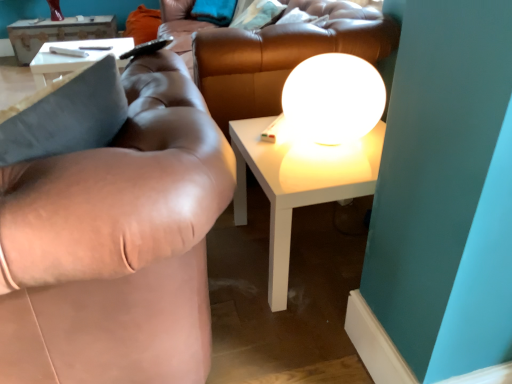
The height and width of the screenshot is (384, 512). I want to click on white glossy table at upper left, which ranks as the first table in left-to-right order, so click(56, 33).

Describe the element at coordinates (117, 244) in the screenshot. This screenshot has width=512, height=384. I see `brown leather couch at left` at that location.

This screenshot has width=512, height=384. Describe the element at coordinates (258, 15) in the screenshot. I see `soft teal pillow at upper center, arranged as the second pillow when viewed from the left` at that location.

This screenshot has width=512, height=384. What are the coordinates of `orange fabric pillow at upper left, the first pillow when ordered from back to front` in the screenshot? It's located at (142, 24).

The width and height of the screenshot is (512, 384). Describe the element at coordinates (272, 53) in the screenshot. I see `brown leather couch at center` at that location.

The image size is (512, 384). What do you see at coordinates (334, 98) in the screenshot? I see `white glossy sphere at upper center` at bounding box center [334, 98].

The width and height of the screenshot is (512, 384). I want to click on white glossy table at center, the second table when ordered from left to right, so click(298, 183).

Does white glossy table at center, the second table when ordered from left to right, come in front of brown leather couch at left?

No, it is not.

Is white glossy table at center, the first table in the right-to-left sequence, thinner than brown leather couch at left?

Yes.

In the image, is white glossy table at center, the second table when ordered from left to right, on the left side or the right side of brown leather couch at left?

In the image, white glossy table at center, the second table when ordered from left to right, appears on the right side of brown leather couch at left.

Where is `studio couch to the left of white glossy table at center, which appears as the first table when ordered from the bottom`? The image size is (512, 384). studio couch to the left of white glossy table at center, which appears as the first table when ordered from the bottom is located at coordinates (117, 244).

Which object is positioned more to the left, white glossy table at center, the 2th table from the top, or orange fabric pillow at upper left, the first pillow when ordered from back to front?

Positioned to the left is orange fabric pillow at upper left, the first pillow when ordered from back to front.

Is white glossy table at center, which appears as the first table when ordered from the bottom, oriented towards orange fabric pillow at upper left, which appears as the 1th pillow when viewed from the left?

No, white glossy table at center, which appears as the first table when ordered from the bottom, is not facing towards orange fabric pillow at upper left, which appears as the 1th pillow when viewed from the left.

Considering the sizes of white glossy table at center, the first table from the front, and orange fabric pillow at upper left, the 2th pillow from the front, in the image, is white glossy table at center, the first table from the front, wider or thinner than orange fabric pillow at upper left, the 2th pillow from the front,?

white glossy table at center, the first table from the front, is thinner than orange fabric pillow at upper left, the 2th pillow from the front.

Considering the points (244, 143) and (149, 20), which point is behind, point (244, 143) or point (149, 20)?

The point (149, 20) is more distant.

This screenshot has height=384, width=512. I want to click on pillow above the brown leather couch at left (from a real-world perspective), so click(x=258, y=15).

Is brown leather couch at left positioned in front of soft teal pillow at upper center, arranged as the 1th pillow when viewed from the front?

Yes, brown leather couch at left is closer to the camera.

Is brown leather couch at left to the left or to the right of soft teal pillow at upper center, arranged as the second pillow when viewed from the left, in the image?

brown leather couch at left is to the left of soft teal pillow at upper center, arranged as the second pillow when viewed from the left.

Based on the photo, who is taller, brown leather couch at left or soft teal pillow at upper center, arranged as the second pillow when viewed from the left?

brown leather couch at left.

Does point (369, 98) come farther from viewer compared to point (33, 44)?

No, (369, 98) is closer to viewer.

Considering the positions of objects white glossy sphere at upper center and white glossy table at upper left, the 1th table when ordered from back to front, in the image provided, who is more to the left, white glossy sphere at upper center or white glossy table at upper left, the 1th table when ordered from back to front,?

white glossy table at upper left, the 1th table when ordered from back to front.

Considering the relative sizes of white glossy sphere at upper center and white glossy table at upper left, which is counted as the 2th table, starting from the bottom, in the image provided, is white glossy sphere at upper center bigger than white glossy table at upper left, which is counted as the 2th table, starting from the bottom,?

Actually, white glossy sphere at upper center might be smaller than white glossy table at upper left, which is counted as the 2th table, starting from the bottom.

Does white glossy sphere at upper center have a greater height compared to white glossy table at upper left, the 1th table when ordered from back to front?

No, white glossy sphere at upper center is not taller than white glossy table at upper left, the 1th table when ordered from back to front.

Which object is positioned more to the right, white glossy table at center, the first table in the right-to-left sequence, or soft teal pillow at upper center, arranged as the second pillow when viewed from the left?

From the viewer's perspective, white glossy table at center, the first table in the right-to-left sequence, appears more on the right side.

Consider the image. From a real-world perspective, who is located lower, white glossy table at center, which appears as the first table when ordered from the bottom, or soft teal pillow at upper center, the 1th pillow from the right?

From a 3D spatial view, white glossy table at center, which appears as the first table when ordered from the bottom, is below.

Who is smaller, white glossy table at center, the second table when ordered from left to right, or soft teal pillow at upper center, the 1th pillow from the right?

soft teal pillow at upper center, the 1th pillow from the right, is smaller.

In the scene shown: Considering the sizes of objects white glossy table at center, positioned as the 2th table in back-to-front order, and soft teal pillow at upper center, the 1th pillow from the right, in the image provided, who is wider, white glossy table at center, positioned as the 2th table in back-to-front order, or soft teal pillow at upper center, the 1th pillow from the right,?

white glossy table at center, positioned as the 2th table in back-to-front order, is wider.

Does point (233, 27) lie in front of point (130, 17)?

Yes, point (233, 27) is in front of point (130, 17).

Are soft teal pillow at upper center, which is the 2th pillow in back-to-front order, and orange fabric pillow at upper left, the second pillow viewed from the right, making contact?

soft teal pillow at upper center, which is the 2th pillow in back-to-front order, and orange fabric pillow at upper left, the second pillow viewed from the right, are clearly separated.

Between soft teal pillow at upper center, which is the 2th pillow in back-to-front order, and orange fabric pillow at upper left, the 2th pillow from the front, which one has smaller width?

Thinner between the two is soft teal pillow at upper center, which is the 2th pillow in back-to-front order.

Which object is positioned more to the right, soft teal pillow at upper center, arranged as the second pillow when viewed from the left, or orange fabric pillow at upper left, which appears as the 1th pillow when viewed from the left?

From the viewer's perspective, soft teal pillow at upper center, arranged as the second pillow when viewed from the left, appears more on the right side.

Considering the sizes of objects white glossy sphere at upper center and orange fabric pillow at upper left, the first pillow when ordered from back to front, in the image provided, who is smaller, white glossy sphere at upper center or orange fabric pillow at upper left, the first pillow when ordered from back to front,?

Smaller between the two is white glossy sphere at upper center.

Is white glossy sphere at upper center located outside orange fabric pillow at upper left, the second pillow viewed from the right?

Yes, white glossy sphere at upper center is not within orange fabric pillow at upper left, the second pillow viewed from the right.

Is white glossy sphere at upper center touching orange fabric pillow at upper left, the first pillow when ordered from back to front?

white glossy sphere at upper center and orange fabric pillow at upper left, the first pillow when ordered from back to front, are not in contact.

Which object is more forward, white glossy sphere at upper center or orange fabric pillow at upper left, which appears as the 1th pillow when viewed from the left?

white glossy sphere at upper center.

This screenshot has height=384, width=512. Identify the location of the 1st table positioned above the brown leather couch at left (from the image's perspective). [x=298, y=183].

Locate an element on the screen. The height and width of the screenshot is (384, 512). pillow that is the 2nd object located behind the white glossy table at center, the 2th table from the top is located at coordinates (142, 24).

Looking at the image, which one is located closer to white glossy sphere at upper center, soft teal pillow at upper center, which is the 2th pillow in back-to-front order, or white glossy table at upper left, which is counted as the 2th table, starting from the bottom?

Among the two, soft teal pillow at upper center, which is the 2th pillow in back-to-front order, is located nearer to white glossy sphere at upper center.

When comparing their distances from soft teal pillow at upper center, the 1th pillow from the right, does brown leather couch at center or orange fabric pillow at upper left, the first pillow when ordered from back to front, seem closer?

The object closer to soft teal pillow at upper center, the 1th pillow from the right, is brown leather couch at center.

Which object lies further to the anchor point white glossy sphere at upper center, orange fabric pillow at upper left, the second pillow viewed from the right, or white glossy table at center, which appears as the first table when ordered from the bottom?

The object further to white glossy sphere at upper center is orange fabric pillow at upper left, the second pillow viewed from the right.

Looking at the image, which one is located further to brown leather couch at left, white glossy sphere at upper center or soft teal pillow at upper center, arranged as the 1th pillow when viewed from the front?

soft teal pillow at upper center, arranged as the 1th pillow when viewed from the front.

Based on their spatial positions, is soft teal pillow at upper center, arranged as the 1th pillow when viewed from the front, or white glossy table at upper left, the 1th table when ordered from back to front, further from orange fabric pillow at upper left, which appears as the 1th pillow when viewed from the left?

soft teal pillow at upper center, arranged as the 1th pillow when viewed from the front.

From the image, which object appears to be nearer to white glossy sphere at upper center, brown leather couch at left or soft teal pillow at upper center, the 1th pillow from the right?

brown leather couch at left lies closer to white glossy sphere at upper center than the other object.

Considering their positions, is brown leather couch at center positioned further to white glossy table at upper left, the second table positioned from the front, than white glossy table at center, the first table in the right-to-left sequence?

The object further to white glossy table at upper left, the second table positioned from the front, is white glossy table at center, the first table in the right-to-left sequence.

Based on their spatial positions, is soft teal pillow at upper center, the 1th pillow from the right, or white glossy table at upper left, which ranks as the first table in left-to-right order, closer to brown leather couch at center?

The object closer to brown leather couch at center is soft teal pillow at upper center, the 1th pillow from the right.

Locate an element on the screen. Image resolution: width=512 pixels, height=384 pixels. table lamp between brown leather couch at left and white glossy table at upper left, which ranks as the first table in left-to-right order, from front to back is located at coordinates (334, 98).

Find the location of a particular element. table positioned between brown leather couch at left and soft teal pillow at upper center, which is the 2th pillow in back-to-front order, from near to far is located at coordinates (298, 183).

Image resolution: width=512 pixels, height=384 pixels. Identify the location of couch located between white glossy sphere at upper center and white glossy table at upper left, the 1th table when ordered from back to front, in the depth direction. (x=272, y=53).

Image resolution: width=512 pixels, height=384 pixels. In order to click on table between brown leather couch at left and orange fabric pillow at upper left, the first pillow when ordered from back to front, from front to back in this screenshot , I will do `click(298, 183)`.